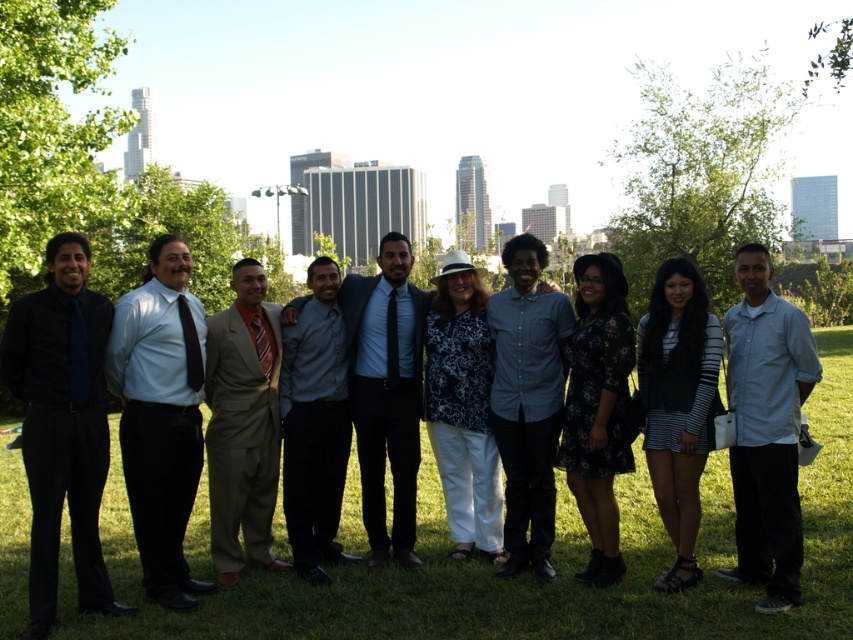
You are standing in the park where the group photo was taken. You notice two points marked in the image. Which point, point (177,433) or point (665,275), is closer to you?

Point (177,433) is closer to you than point (665,275).